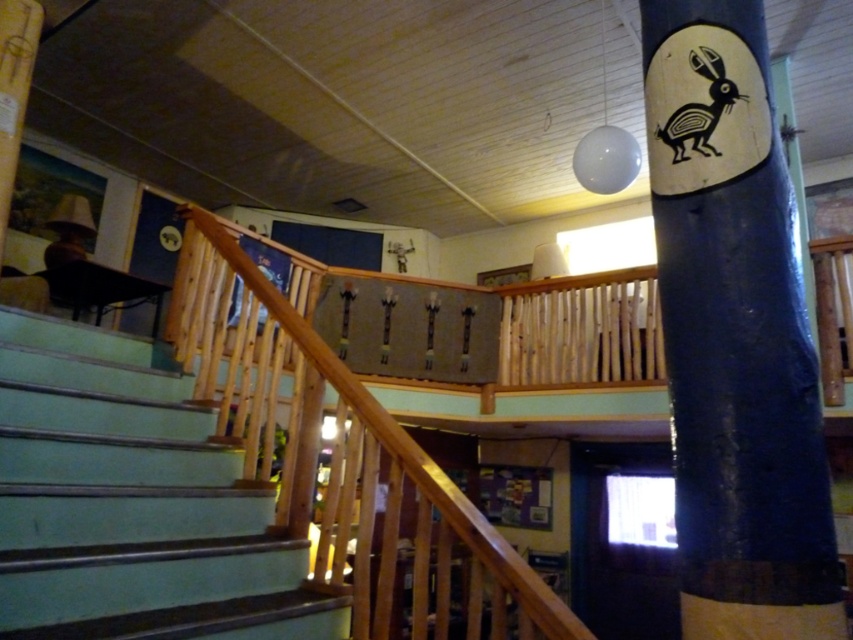
Question: Is blue painted wood pole at center positioned in front of teal painted wood stairs at lower left?

Choices:
 (A) no
 (B) yes

Answer: (B)

Question: Is teal painted wood stairs at lower left below wooden at upper center?

Choices:
 (A) yes
 (B) no

Answer: (B)

Question: Which point is farther from the camera taking this photo?

Choices:
 (A) (239, 292)
 (B) (838, 612)

Answer: (A)

Question: Which object is positioned closest to the blue painted wood pole at center?

Choices:
 (A) wooden at upper center
 (B) teal painted wood stairs at lower left

Answer: (A)

Question: Is blue painted wood pole at center closer to the viewer compared to wooden at upper center?

Choices:
 (A) yes
 (B) no

Answer: (A)

Question: Which object appears farthest from the camera in this image?

Choices:
 (A) teal painted wood stairs at lower left
 (B) blue painted wood pole at center
 (C) wooden at upper center

Answer: (A)